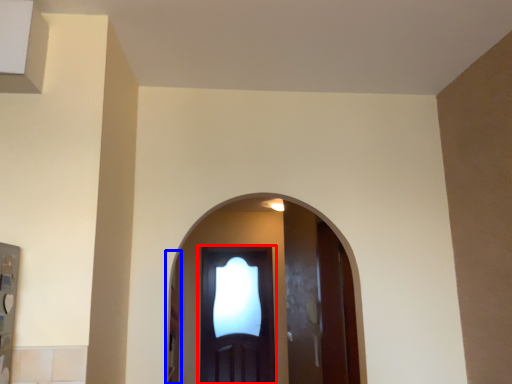
Question: Which object appears closest to the camera in this image, door (highlighted by a red box) or screen door (highlighted by a blue box)?

Choices:
 (A) door
 (B) screen door

Answer: (B)